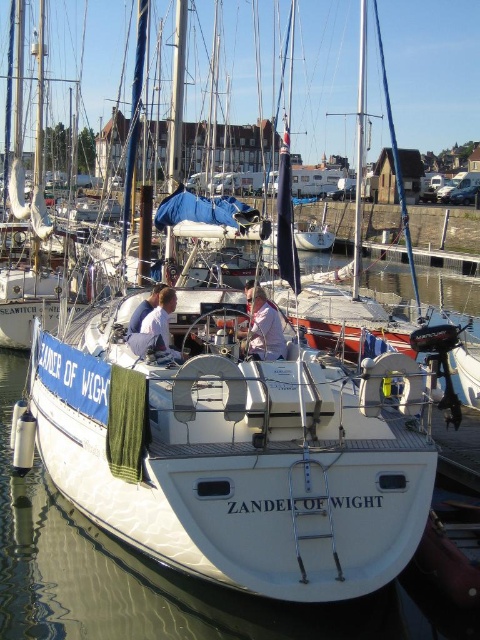
You are a sailor standing on the deck of the Zander of Wight. You need to retrieve an item from the pink fabric at center and the white fabric shirt at center. Which item should you reach for first to avoid bending down?

You should reach for the pink fabric at center first because it is closer to you than the white fabric shirt at center, so you can grab it without bending down.

Looking at this image, you are standing on the wooden pier where the white sailboat named Zander of Wight is docked. You notice a point marked at coordinates (263, 326). What object is located at that point?

The point at coordinates (263, 326) marks the location of the pink fabric at center.